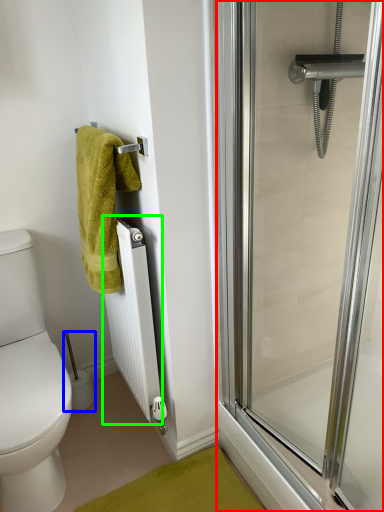
Question: Considering the real-world distances, which object is closest to screen door (highlighted by a red box)? toilet paper (highlighted by a blue box) or radiator (highlighted by a green box).

Choices:
 (A) toilet paper
 (B) radiator

Answer: (B)